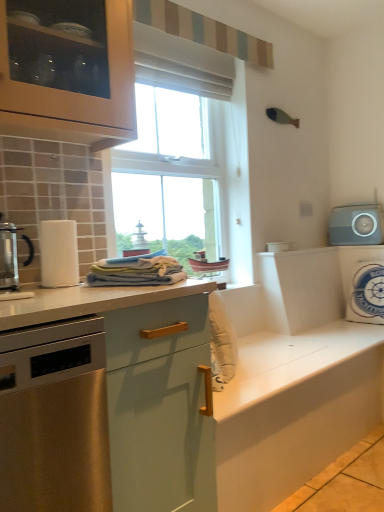
Question: Is white matte cabinet at center situated inside metallic glass coffee maker at left or outside?

Choices:
 (A) inside
 (B) outside

Answer: (B)

Question: Is white matte cabinet at center taller or shorter than metallic glass coffee maker at left?

Choices:
 (A) short
 (B) tall

Answer: (B)

Question: Considering the real-world distances, which object is closest to the matte white countertop at center?

Choices:
 (A) metallic glass coffee maker at left
 (B) stainless steel dishwasher at left
 (C) white plastic container at upper right, the 2th appliance from the bottom
 (D) gray matte speaker at upper right, which ranks as the third appliance in left-to-right order
 (E) white fabric pillow at right, positioned as the 1th appliance in bottom-to-top order

Answer: (B)

Question: Which is nearer to the stainless steel dishwasher at left?

Choices:
 (A) white plastic container at upper right, the first appliance from the left
 (B) white matte cabinet at center
 (C) matte white countertop at center
 (D) white fabric pillow at right, positioned as the 2th appliance in right-to-left order
 (E) metallic glass coffee maker at left

Answer: (C)